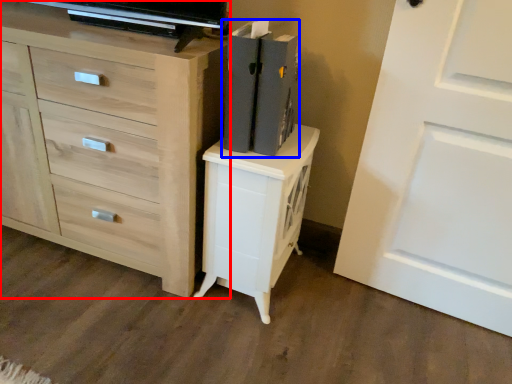
Question: Which of the following is the closest to the observer, chest of drawers (highlighted by a red box) or book (highlighted by a blue box)?

Choices:
 (A) chest of drawers
 (B) book

Answer: (A)